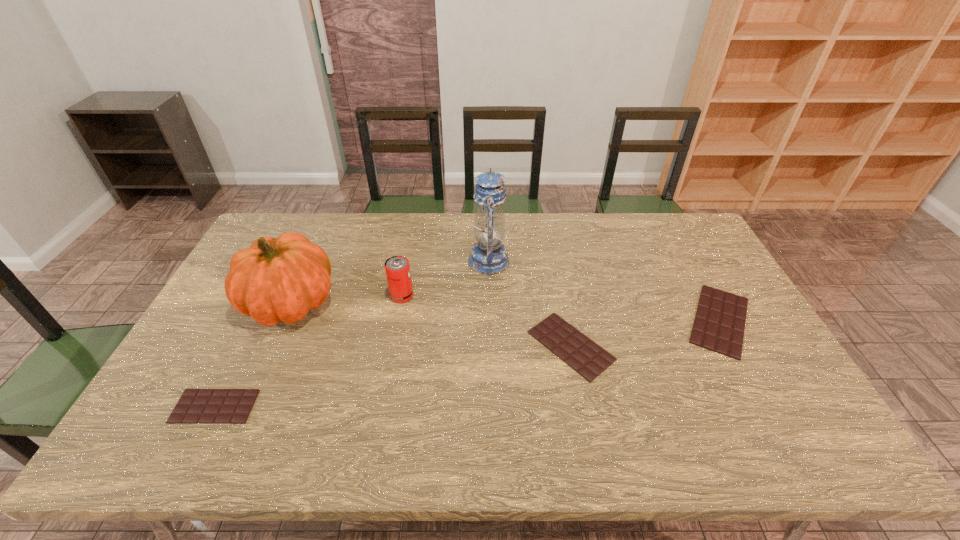
Where is `free region located 0.400m on the back of the shortest chocolate bar`? Image resolution: width=960 pixels, height=540 pixels. free region located 0.400m on the back of the shortest chocolate bar is located at coordinates (277, 282).

I want to click on blank area located on the left of the second chocolate bar from right to left, so click(409, 346).

You are a GUI agent. You are given a task and a screenshot of the screen. Output one action in this format:
    pyautogui.click(x=<x>, y=<y>)
    Task: Click on the vacant space situated on the back of the rightmost object
    The width and height of the screenshot is (960, 540).
    Given the screenshot: What is the action you would take?
    pyautogui.click(x=695, y=275)

Image resolution: width=960 pixels, height=540 pixels. I want to click on vacant space situated on the front-facing side of the lantern, so tap(442, 261).

Image resolution: width=960 pixels, height=540 pixels. I want to click on free point located on the front-facing side of the lantern, so point(368,261).

Image resolution: width=960 pixels, height=540 pixels. Identify the location of vacant space positioned 0.130m on the front-facing side of the lantern. (430, 261).

You are a GUI agent. You are given a task and a screenshot of the screen. Output one action in this format:
    pyautogui.click(x=<x>, y=<y>)
    Task: Click on the free space located 0.170m on the left of the third tallest object
    
    Given the screenshot: What is the action you would take?
    pyautogui.click(x=335, y=296)

The image size is (960, 540). Identify the location of blank area located on the right of the fifth shortest object. (466, 302).

I want to click on object that is positioned at the far edge, so click(488, 257).

Where is `object located in the near edge section of the desktop`? This screenshot has width=960, height=540. object located in the near edge section of the desktop is located at coordinates (196, 406).